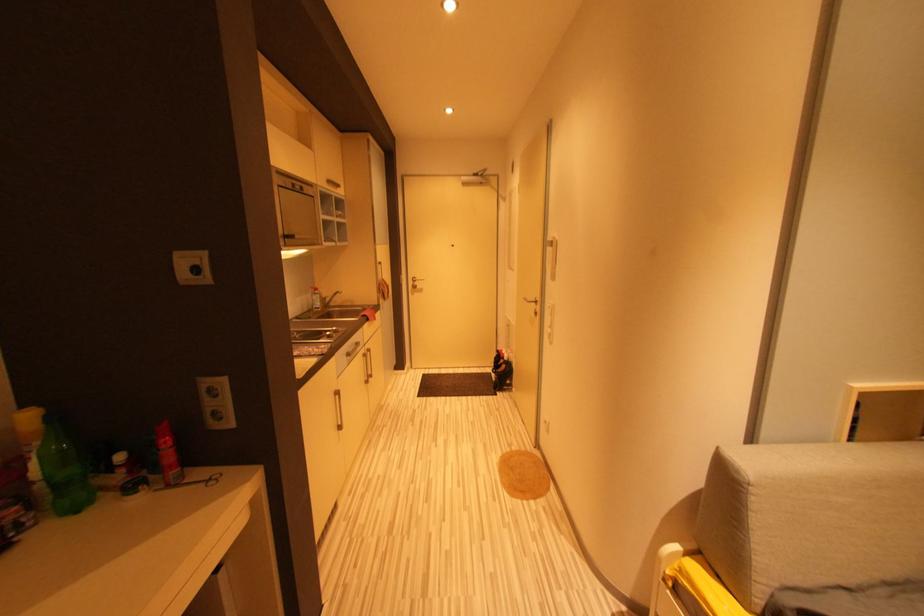
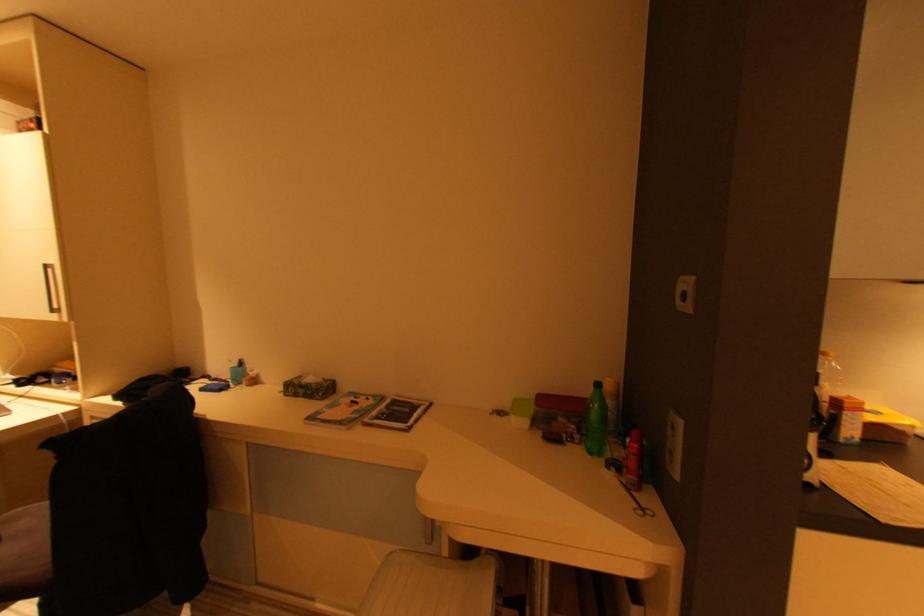
Question: The camera is either moving clockwise (left) or counter-clockwise (right) around the object. The first image is from the beginning of the video and the second image is from the end. Is the camera moving left or right when shooting the video?

Choices:
 (A) Left
 (B) Right

Answer: (B)